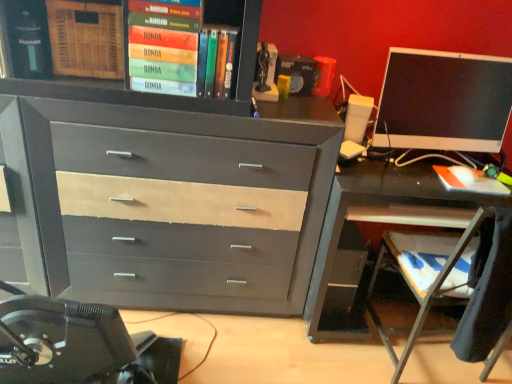
Identify the location of free spot above orange matte book at right, the first book viewed from the right (from a real-world perspective). (474, 176).